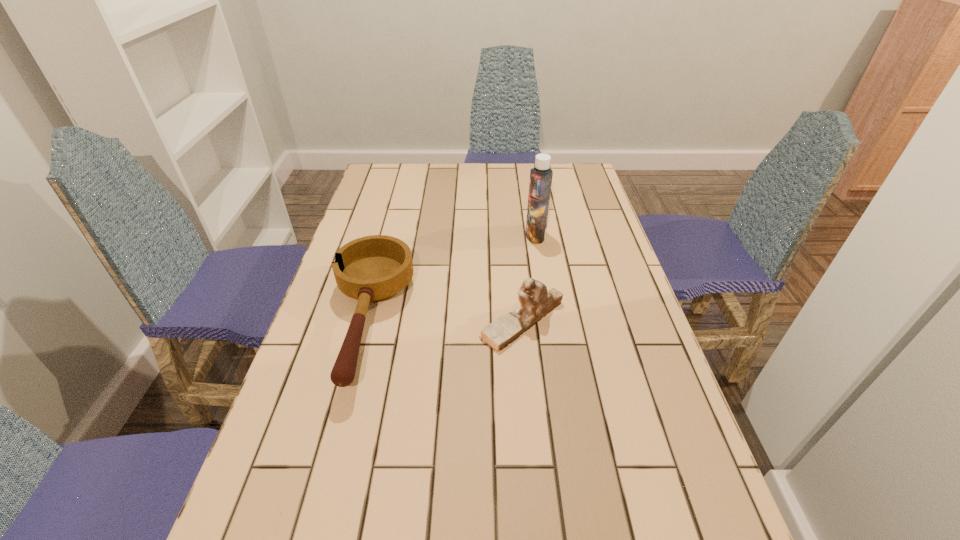
You are a GUI agent. You are given a task and a screenshot of the screen. Output one action in this format:
    pyautogui.click(x=<x>, y=<y>)
    Task: Click on the free location that satisfies the following two spatial constraints: 1. on the front-facing side of the second tallest object; 2. with the handle on the side of the leftmost object
    The image size is (960, 540).
    Given the screenshot: What is the action you would take?
    pyautogui.click(x=522, y=321)